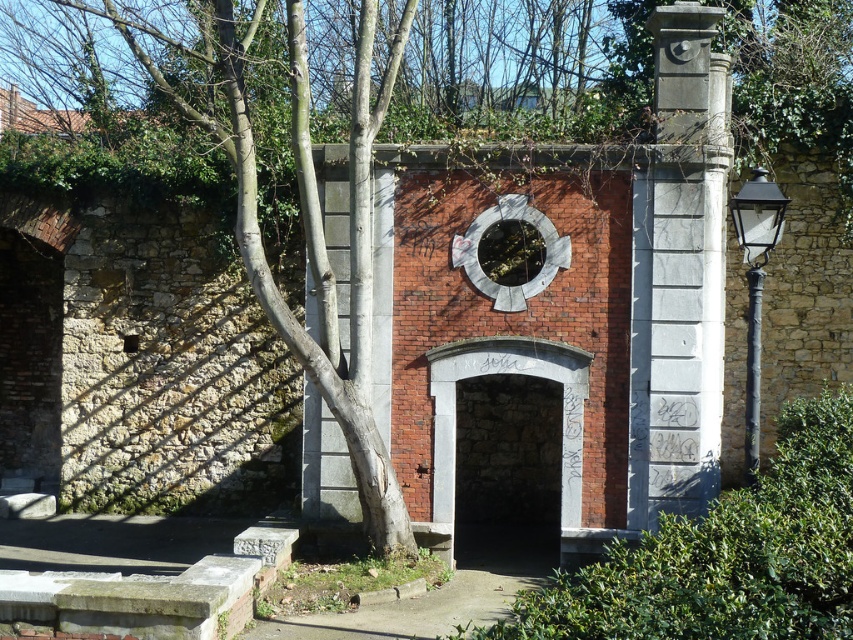
Can you confirm if gray marble column at right is positioned above stone archway at center?

Yes.

Does gray marble column at right appear on the left side of stone archway at center?

In fact, gray marble column at right is to the right of stone archway at center.

The width and height of the screenshot is (853, 640). What do you see at coordinates (677, 275) in the screenshot?
I see `gray marble column at right` at bounding box center [677, 275].

The height and width of the screenshot is (640, 853). What are the coordinates of `gray marble column at right` in the screenshot? It's located at (677, 275).

Looking at this image, does green leafy ivy at center have a smaller size compared to gray marble column at right?

Correct, green leafy ivy at center occupies less space than gray marble column at right.

Locate an element on the screen. This screenshot has height=640, width=853. green leafy ivy at center is located at coordinates (724, 556).

Describe the element at coordinates (724, 556) in the screenshot. I see `green leafy ivy at center` at that location.

Identify the location of green leafy ivy at center. (724, 556).

Is green leafy ivy at center thinner than stone archway at center?

Correct, green leafy ivy at center's width is less than stone archway at center's.

Does point (666, 566) come behind point (556, 438)?

That is False.

Image resolution: width=853 pixels, height=640 pixels. In order to click on green leafy ivy at center in this screenshot , I will do `click(724, 556)`.

Locate an element on the screen. green leafy ivy at center is located at coordinates (724, 556).